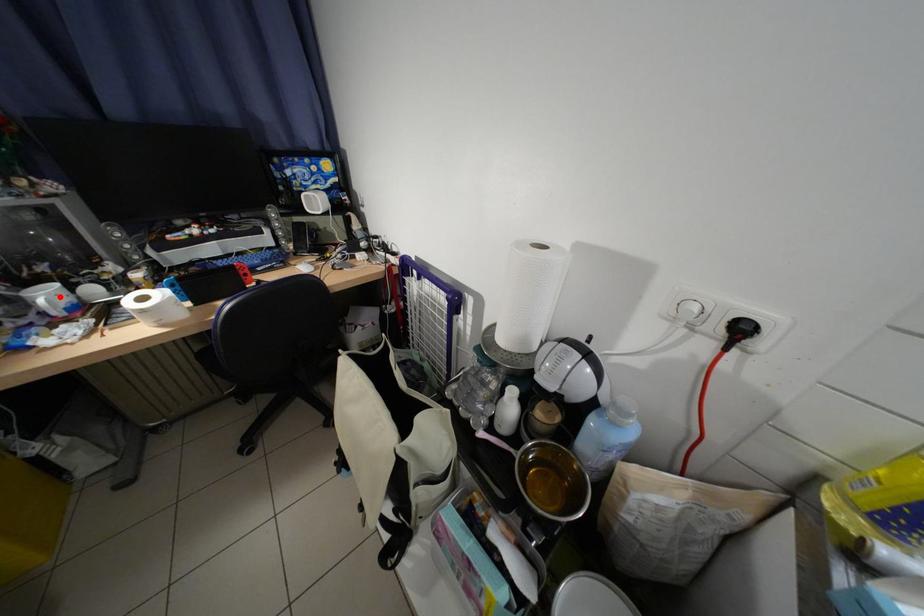
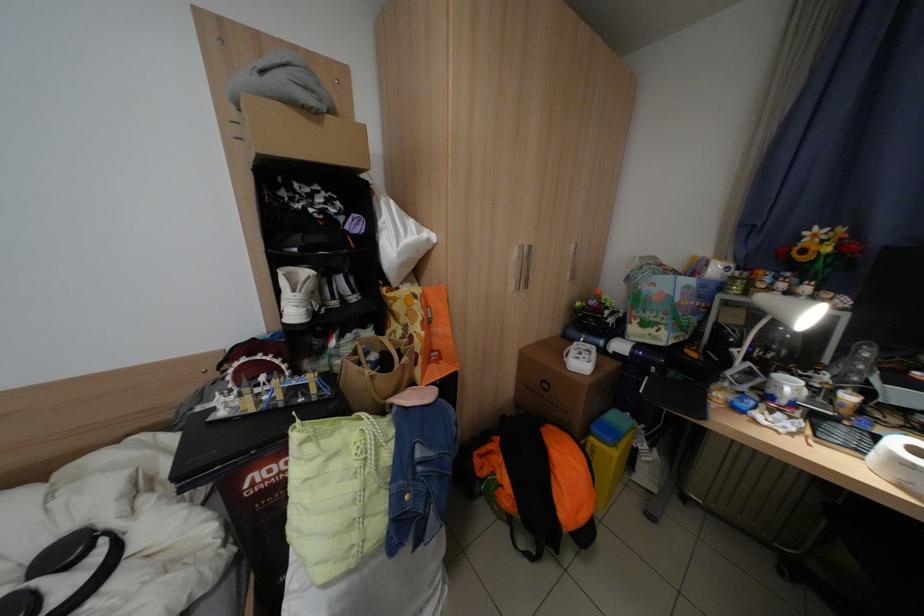
Locate, in the second image, the point that corresponds to the highlighted location in the first image.

(800, 387)